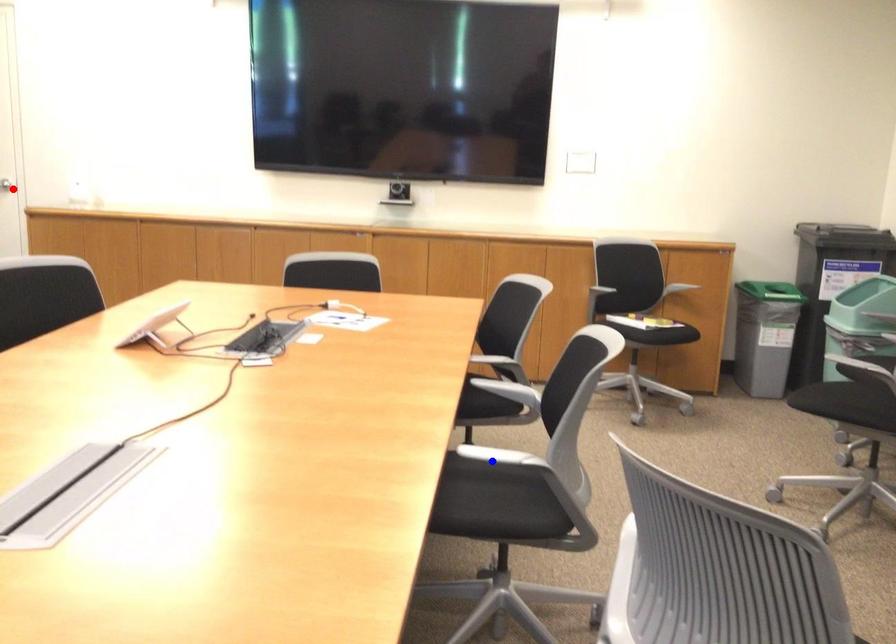
Question: Which of the two points in the image is closer to the camera?

Choices:
 (A) Blue point is closer.
 (B) Red point is closer.

Answer: (A)